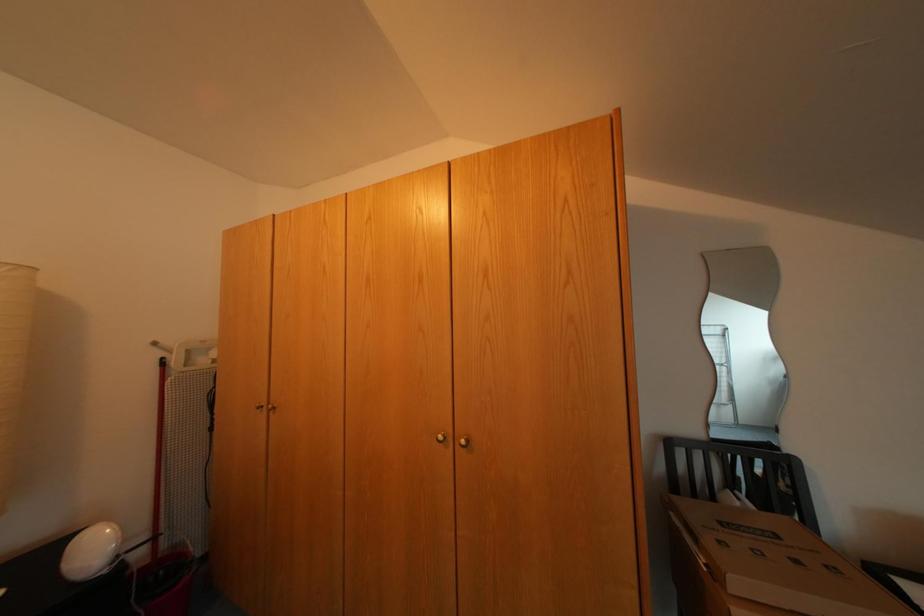
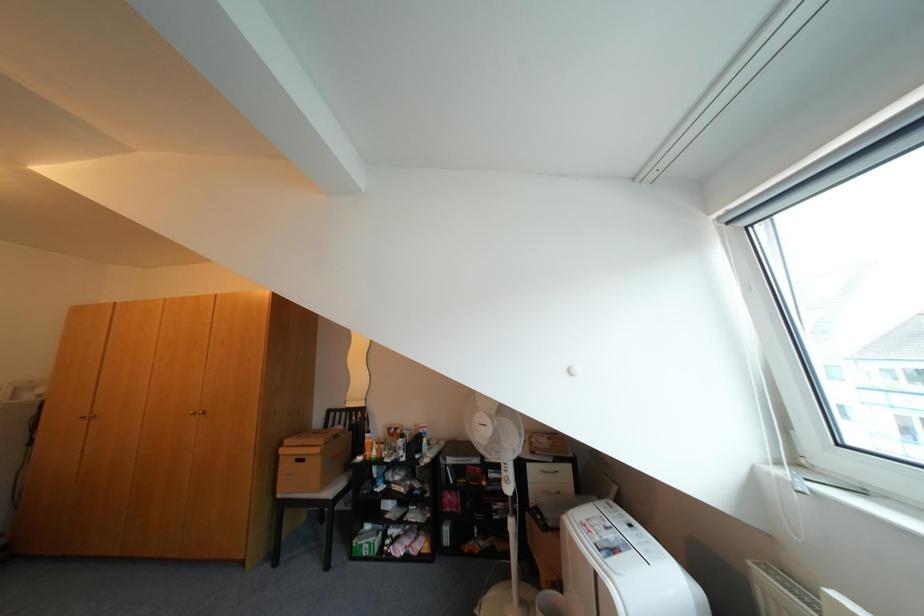
What movement of the cameraman would produce the second image?

The cameraman moved toward right, backward.